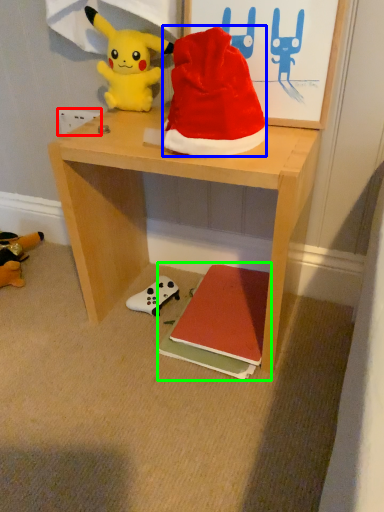
Question: Considering the real-world distances, which object is farthest from power outlet (highlighted by a red box)? hat (highlighted by a blue box) or book (highlighted by a green box)?

Choices:
 (A) hat
 (B) book

Answer: (B)